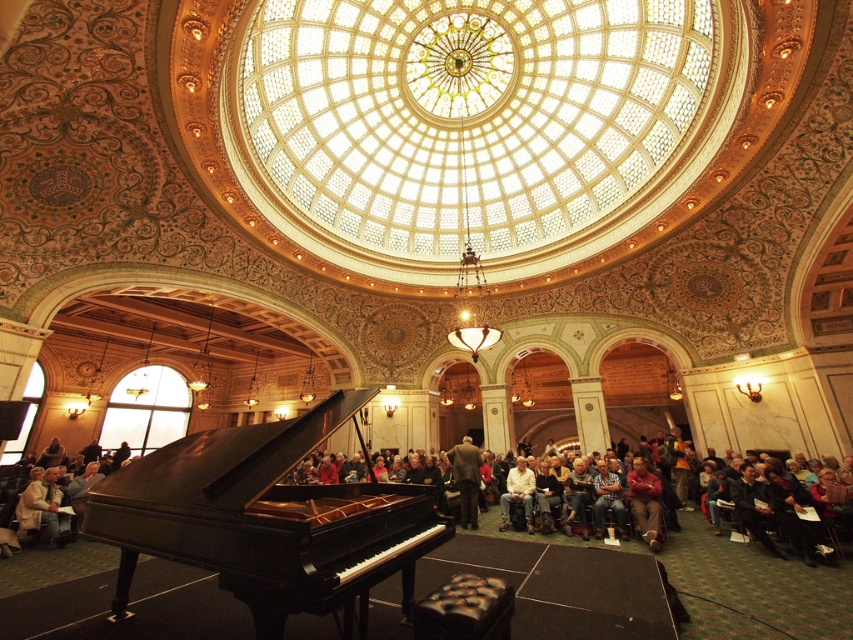
You are an usher at the concert hall and need to retrieve a coat for a guest. You see the red velvet coat at lower center and the dark brown leather jacket at center. Which coat is easier to reach without moving any other items?

The red velvet coat at lower center is closer to the viewer than the dark brown leather jacket at center, so it is easier to reach without moving other items.